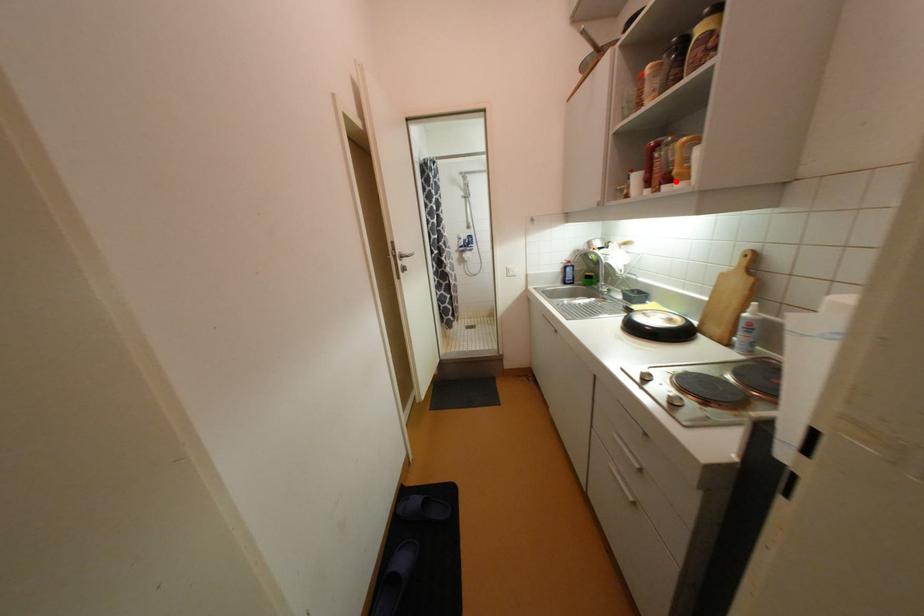
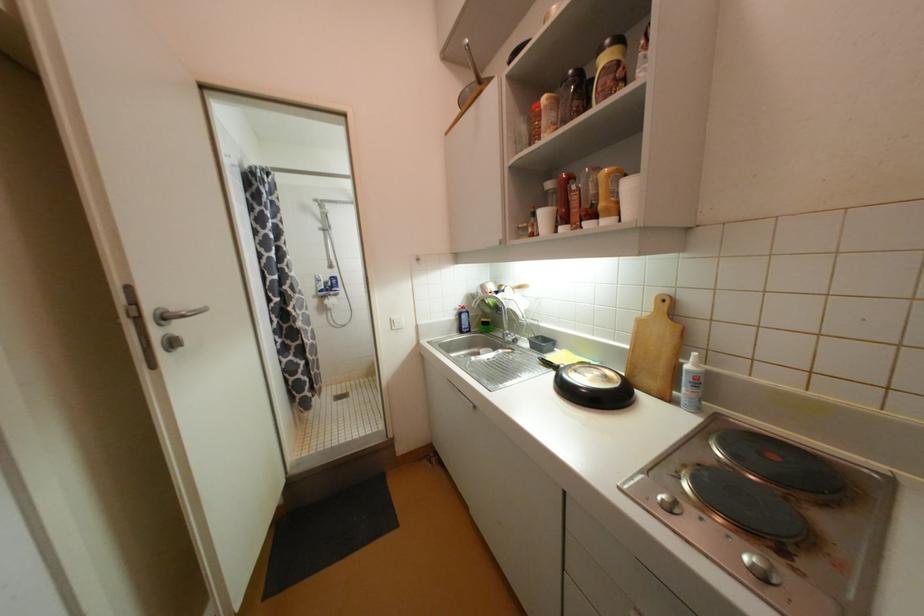
In the second image, find the point that corresponds to the highlighted location in the first image.

(600, 217)